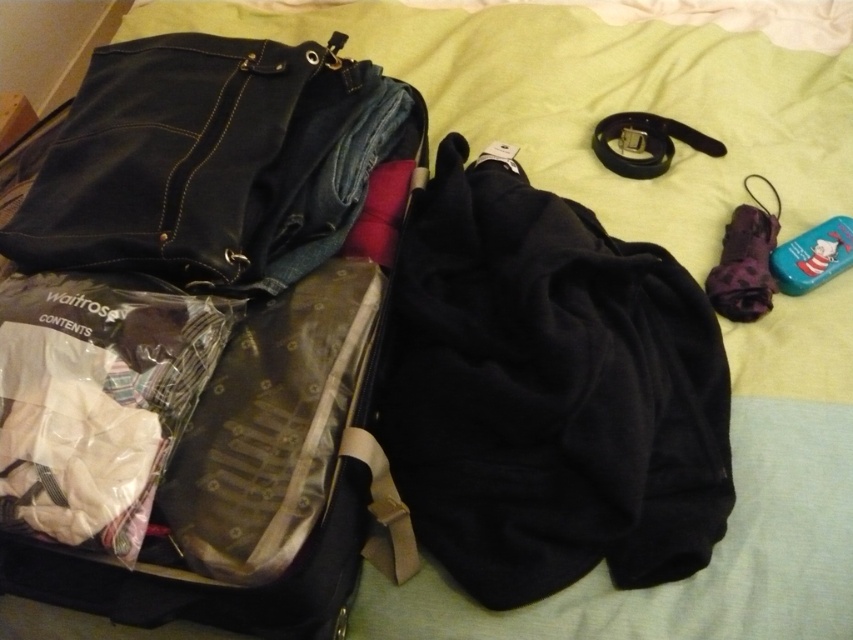
You are standing in front of the suitcase on the bed. There are two points marked in the image. The first point is at coordinate (288, 49) and the second point is at (671, 506). Which point is closer to you?

Point (288, 49) is closer to you than point (671, 506) because it is further to the camera.